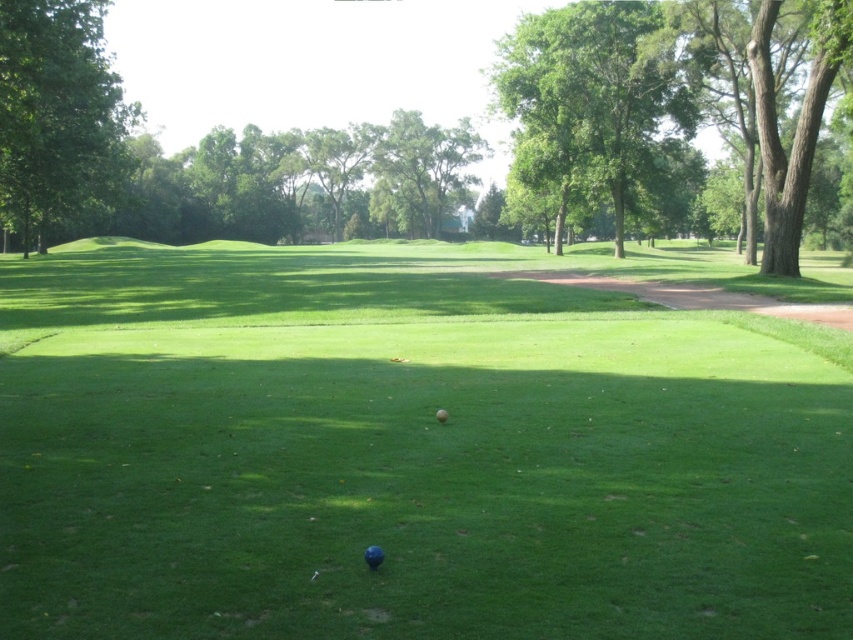
Question: Which of the following is the closest to the observer?

Choices:
 (A) pyautogui.click(x=601, y=65)
 (B) pyautogui.click(x=374, y=547)

Answer: (B)

Question: Considering the relative positions of green grass at center and blue rubber golf ball at center in the image provided, where is green grass at center located with respect to blue rubber golf ball at center?

Choices:
 (A) below
 (B) above

Answer: (B)

Question: Is green grass at center bigger than green leafy tree at left?

Choices:
 (A) no
 (B) yes

Answer: (A)

Question: Which object appears farthest from the camera in this image?

Choices:
 (A) green grass at center
 (B) blue matte golf ball at center
 (C) green leafy tree at left
 (D) green leafy tree at upper center

Answer: (D)

Question: Which of the following is the closest to the observer?

Choices:
 (A) (25, 132)
 (B) (628, 276)
 (C) (379, 556)
 (D) (624, 236)

Answer: (C)

Question: Is blue rubber golf ball at center thinner than blue matte golf ball at center?

Choices:
 (A) no
 (B) yes

Answer: (B)